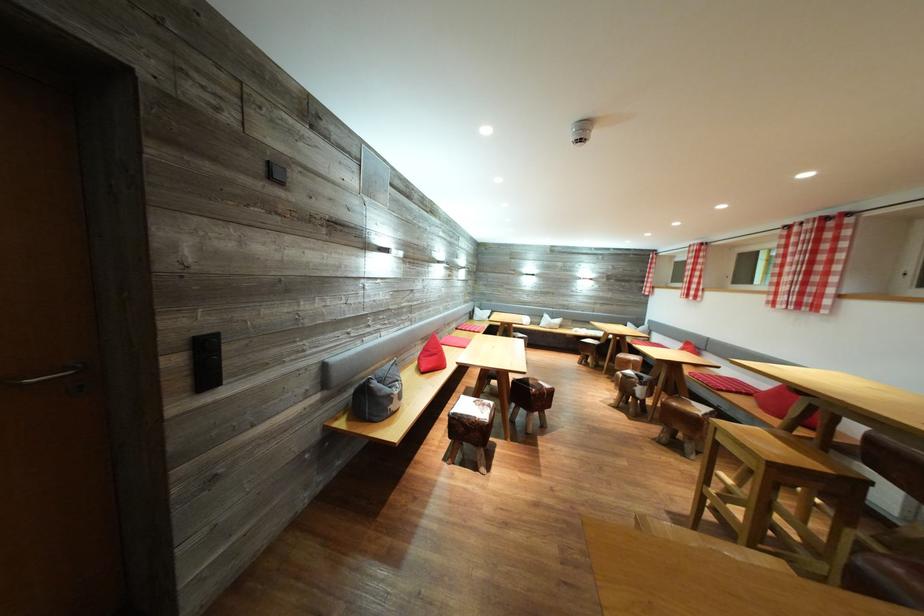
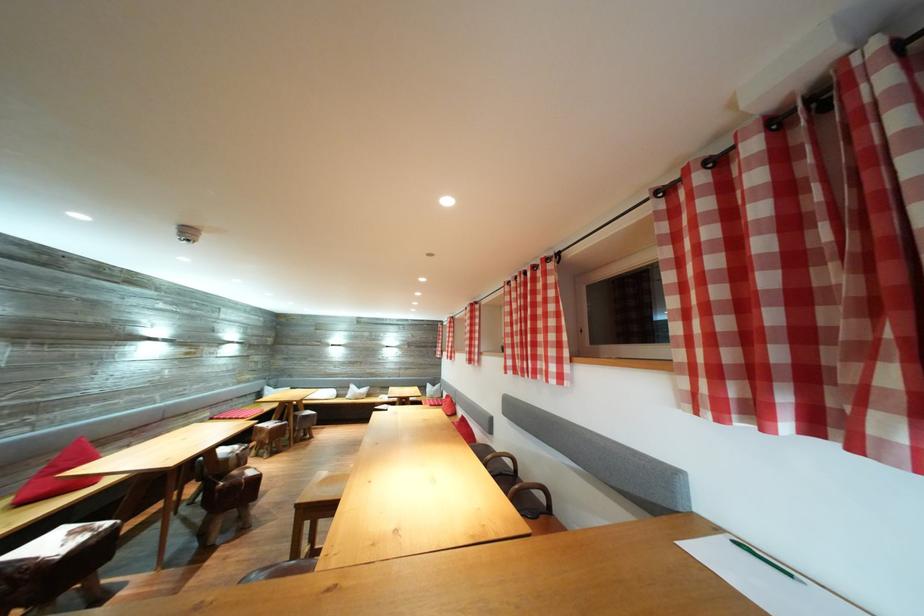
Find the pixel in the second image that matches point (568, 331) in the first image.

(375, 400)